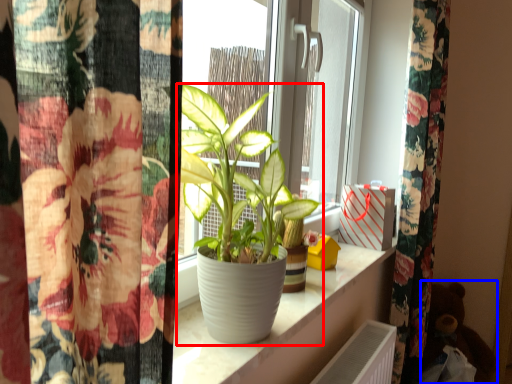
Question: Among these objects, which one is farthest to the camera, houseplant (highlighted by a red box) or toy (highlighted by a blue box)?

Choices:
 (A) houseplant
 (B) toy

Answer: (B)